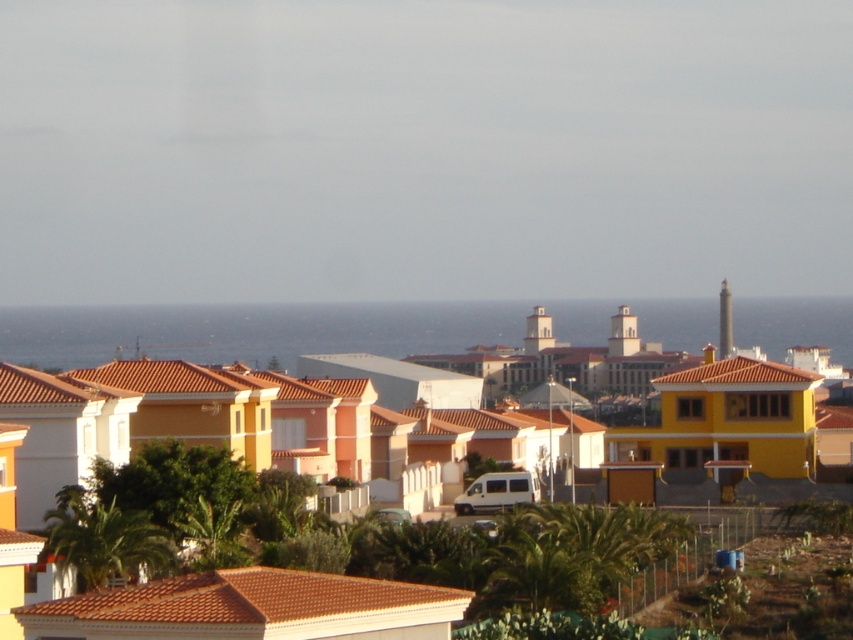
Question: Is green leafy palm tree at lower left below green leafy palm tree at lower center?

Choices:
 (A) yes
 (B) no

Answer: (A)

Question: Which point appears closest to the camera in this image?

Choices:
 (A) (224, 516)
 (B) (114, 531)

Answer: (B)

Question: Which of the following is the closest to the observer?

Choices:
 (A) (71, 529)
 (B) (234, 509)

Answer: (A)

Question: Is green leafy palm tree at lower left to the right of green leafy palm tree at lower center from the viewer's perspective?

Choices:
 (A) yes
 (B) no

Answer: (B)

Question: Is green leafy palm tree at lower left positioned before green leafy palm tree at lower center?

Choices:
 (A) yes
 (B) no

Answer: (A)